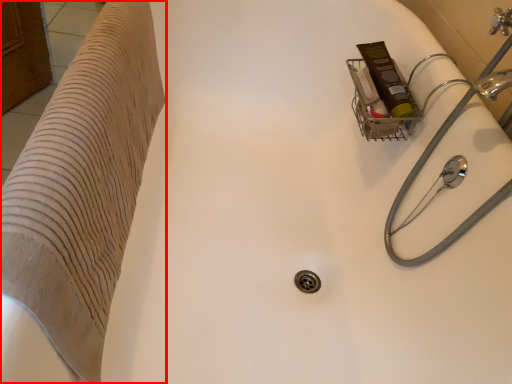
Question: Considering the relative positions of furniture (annotated by the red box) and water pipe in the image provided, where is furniture (annotated by the red box) located with respect to the staircase?

Choices:
 (A) left
 (B) right

Answer: (A)